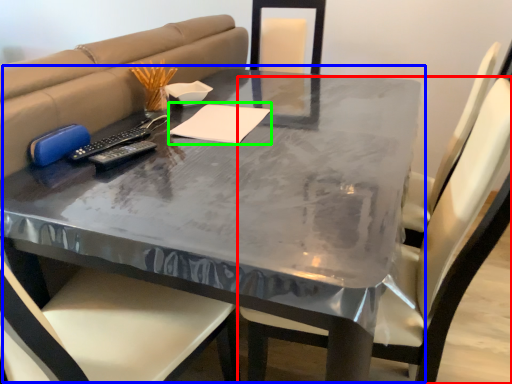
Question: Estimate the real-world distances between objects in this image. Which object is farther from chair (highlighted by a red box), table (highlighted by a blue box) or notepad (highlighted by a green box)?

Choices:
 (A) table
 (B) notepad

Answer: (B)